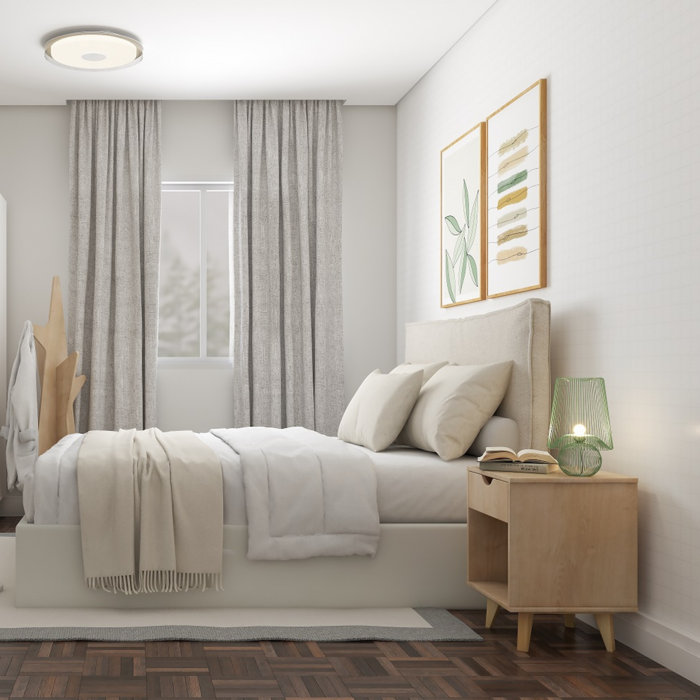
You are a GUI agent. You are given a task and a screenshot of the screen. Output one action in this format:
    pyautogui.click(x=<x>, y=<y>)
    Task: Click on the neckroll pillow
    
    Given the screenshot: What is the action you would take?
    pyautogui.click(x=496, y=423), pyautogui.click(x=510, y=437), pyautogui.click(x=491, y=444), pyautogui.click(x=475, y=449)